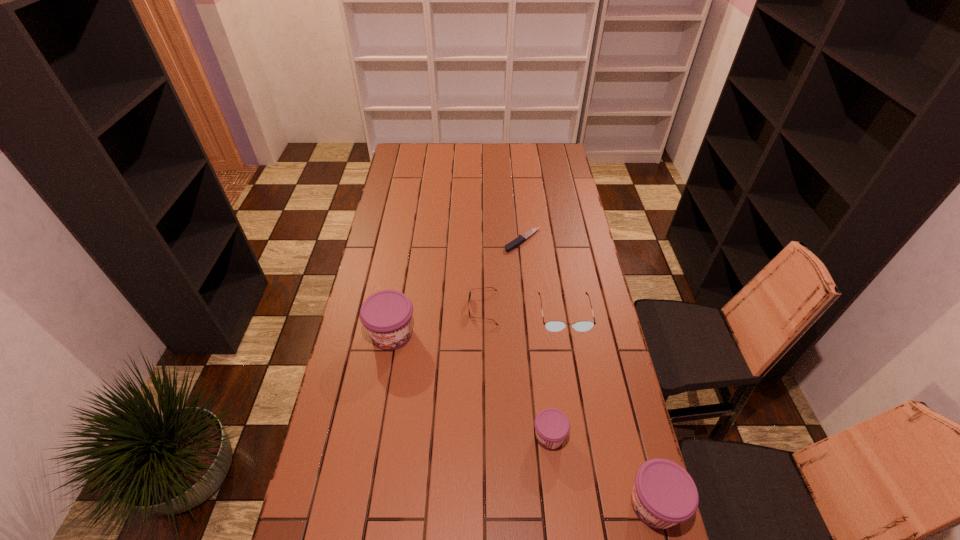
Where is `vacant space at the left edge of the desktop`? The height and width of the screenshot is (540, 960). vacant space at the left edge of the desktop is located at coordinates (404, 206).

Find the location of a particular element. This screenshot has width=960, height=540. blank area at the right edge is located at coordinates (571, 366).

Locate an element on the screen. Image resolution: width=960 pixels, height=540 pixels. vacant position at the near left corner of the desktop is located at coordinates (346, 531).

The image size is (960, 540). What are the coordinates of `free space that is in between the fourth shortest object and the rightmost jam` in the screenshot? It's located at (602, 470).

Find the location of a particular element. blank region between the sunglasses and the rightmost jam is located at coordinates (568, 406).

Locate an element on the screen. Image resolution: width=960 pixels, height=540 pixels. vacant space in between the third shortest object and the leftmost jam is located at coordinates (478, 323).

Image resolution: width=960 pixels, height=540 pixels. I want to click on unoccupied position between the second jam from right to left and the nearest jam, so click(x=602, y=470).

What are the coordinates of `free spot between the second nearest jam and the shortest object` in the screenshot? It's located at pyautogui.click(x=537, y=339).

Locate an element on the screen. Image resolution: width=960 pixels, height=540 pixels. vacant area that lies between the shortest object and the nearest object is located at coordinates (588, 373).

Identify the location of empty space that is in between the fifth tallest object and the shortest jam. [x=516, y=372].